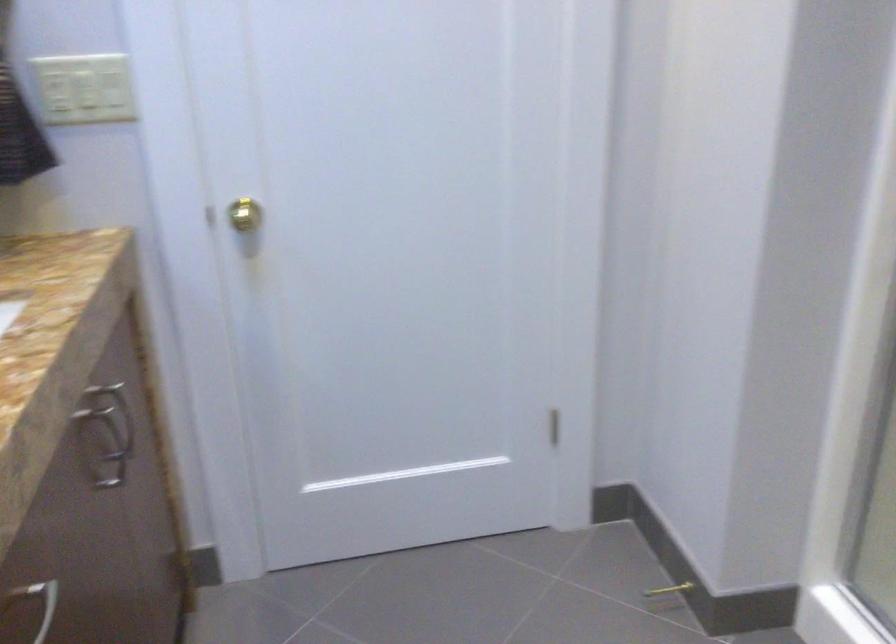
The width and height of the screenshot is (896, 644). What are the coordinates of `door stopper` in the screenshot? It's located at (666, 596).